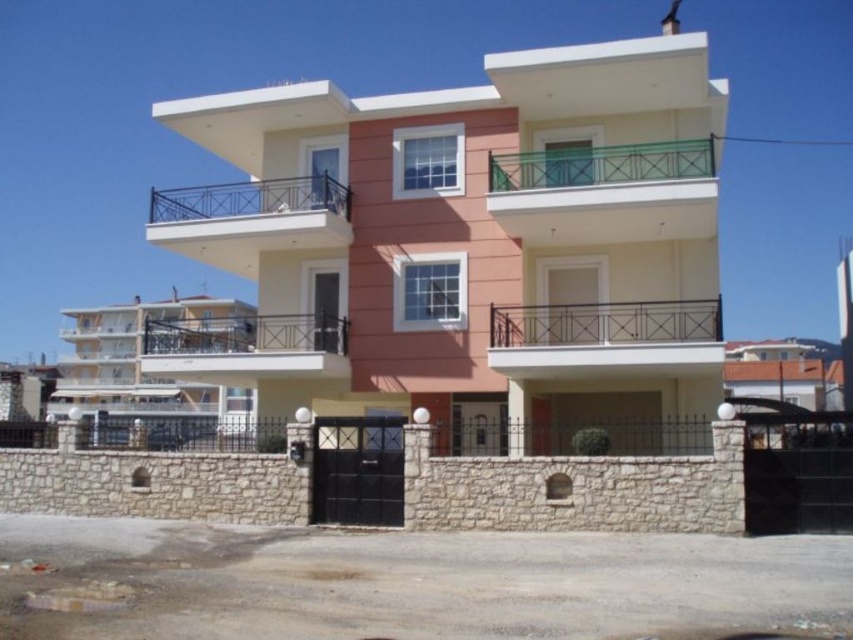
You are a delivery person approaching the building and need to place a package on the white matte balcony at center. However, there is a black metal railing at upper center in the way. Can you still place the package on the balcony without climbing over the railing?

The white matte balcony at center is located below the black metal railing at upper center, so you can place the package on the white matte balcony at center without needing to climb over the railing since it is positioned beneath the railing.

You are a window installer assessing the building. You need to place a new window that requires a minimum of 1.2 meters of vertical clearance. Can the white matte balcony at center or the green metal railing at upper center accommodate this requirement?

The white matte balcony at center is taller than the green metal railing at upper center. Since the balcony is taller, it can provide the required 1.2 meters of vertical clearance, while the railing may not have sufficient height. Therefore, the new window should be installed on the white matte balcony at center.

You are an architect designing a safety inspection plan for the residential building. You need to ensure that the green metal railing at upper center and the black metal railing at upper center meet the minimum height requirement of 1.2 meters. Based on the description, which railing is more likely to comply with the safety standard?

The black metal railing at upper center is more likely to comply with the safety standard since it is larger than the green metal railing at upper center, which is smaller and might not meet the required height of 1.2 meters.